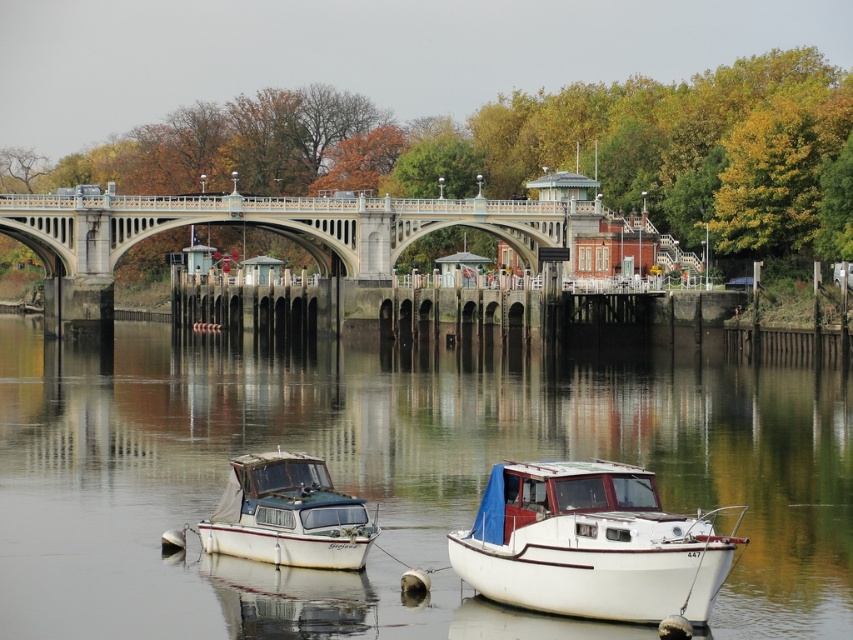
You are standing on the riverside and want to take a photo of the greenish water at center and the white matte boat at lower left. Which object should you focus on first to ensure it appears sharp in your photo?

You should focus on the greenish water at center first because it is closer to the viewer than the white matte boat at lower left, so focusing on the closer object ensures it will be sharp.

You are standing at the point marked as point (392, 477) in the image. What type of surface are you currently standing on?

The point (392, 477) is on greenish water at center, so you are standing on greenish water.

You are a dock attendant who needs to ensure that both boats can fit side by side on a 10 meter wide dock. Based on the scene, can you confirm if the white matte boat at lower right and the white matte boat at lower left can fit together without overlapping?

The white matte boat at lower right might be wider than the white matte boat at lower left. However, without exact measurements, it is uncertain if their combined width exceeds 10 meters. Further information is needed to confirm.